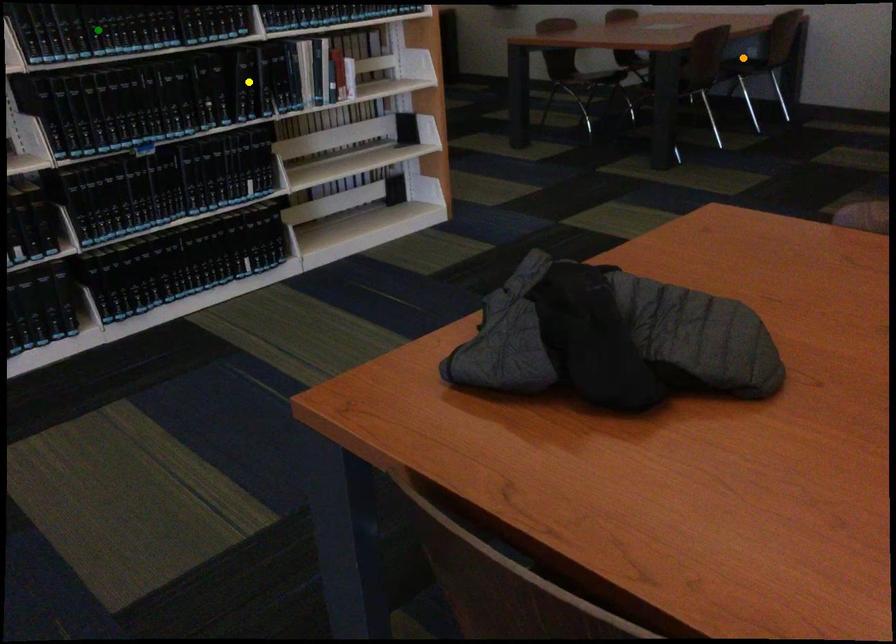
Order these from nearest to farthest:
A) green point
B) orange point
C) yellow point

green point → yellow point → orange point